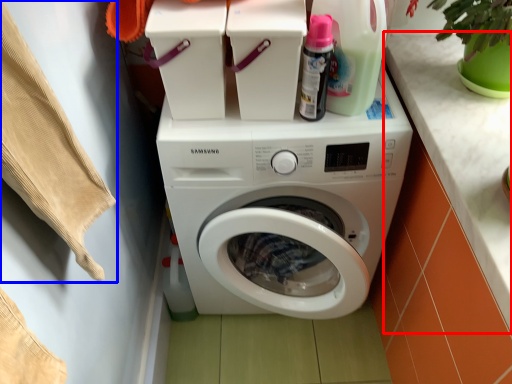
Question: Among these objects, which one is farthest to the camera, counter top (highlighted by a red box) or clothing (highlighted by a blue box)?

Choices:
 (A) counter top
 (B) clothing

Answer: (A)